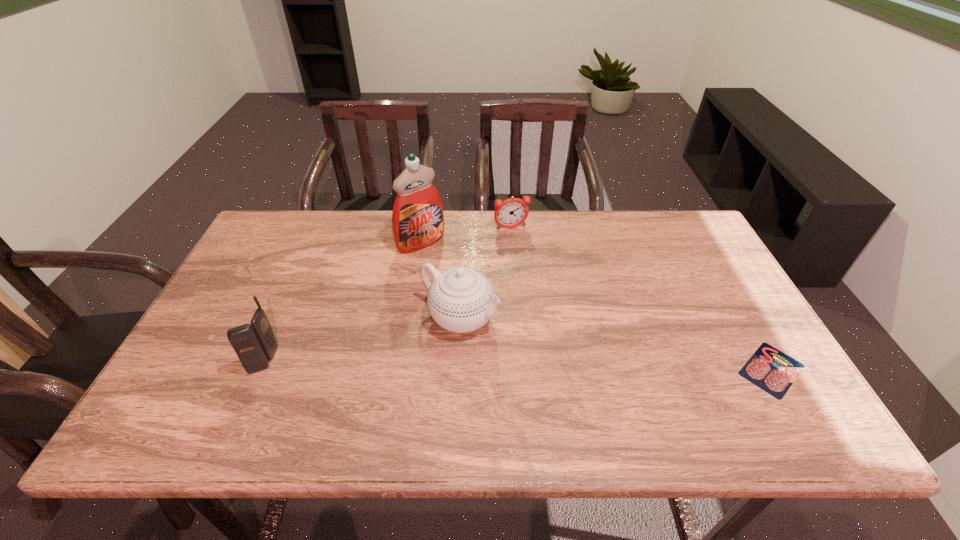
Locate which object ranks second in proximity to the salami. Please provide its 2D coordinates. Your answer should be formatted as a tuple, i.e. [(x, y)], where the tuple contains the x and y coordinates of a point satisfying the conditions above.

[(512, 212)]

Identify which object is the second closest to the chinaware. Please provide its 2D coordinates. Your answer should be formatted as a tuple, i.e. [(x, y)], where the tuple contains the x and y coordinates of a point satisfying the conditions above.

[(512, 212)]

You are a GUI agent. You are given a task and a screenshot of the screen. Output one action in this format:
    pyautogui.click(x=<x>, y=<y>)
    Task: Click on the vacant space that satisfies the following two spatial constraints: 1. on the front side of the tallest object; 2. on the left side of the chinaware
    
    Given the screenshot: What is the action you would take?
    pyautogui.click(x=410, y=318)

Identify the location of vacant space that satisfies the following two spatial constraints: 1. on the front side of the chinaware; 2. on the right side of the rightmost object. (458, 370).